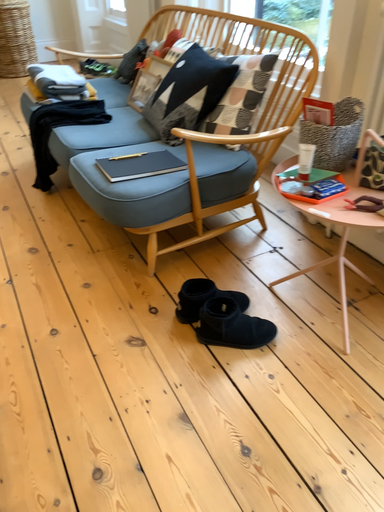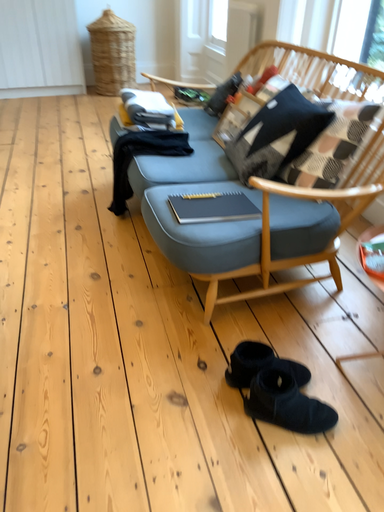
Question: Which way did the camera rotate in the video?

Choices:
 (A) rotated left
 (B) rotated right

Answer: (A)